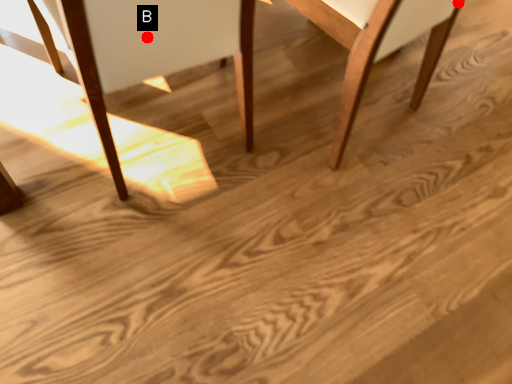
Question: Two points are circled on the image, labeled by A and B beside each circle. Among these points, which one is farthest from the camera?

Choices:
 (A) A is further
 (B) B is further

Answer: (A)